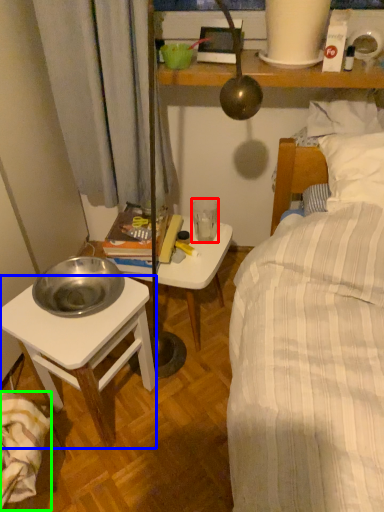
Question: Estimate the real-world distances between objects in this image. Which object is farther from coffee cup (highlighted by a red box), desk (highlighted by a blue box) or blanket (highlighted by a green box)?

Choices:
 (A) desk
 (B) blanket

Answer: (B)